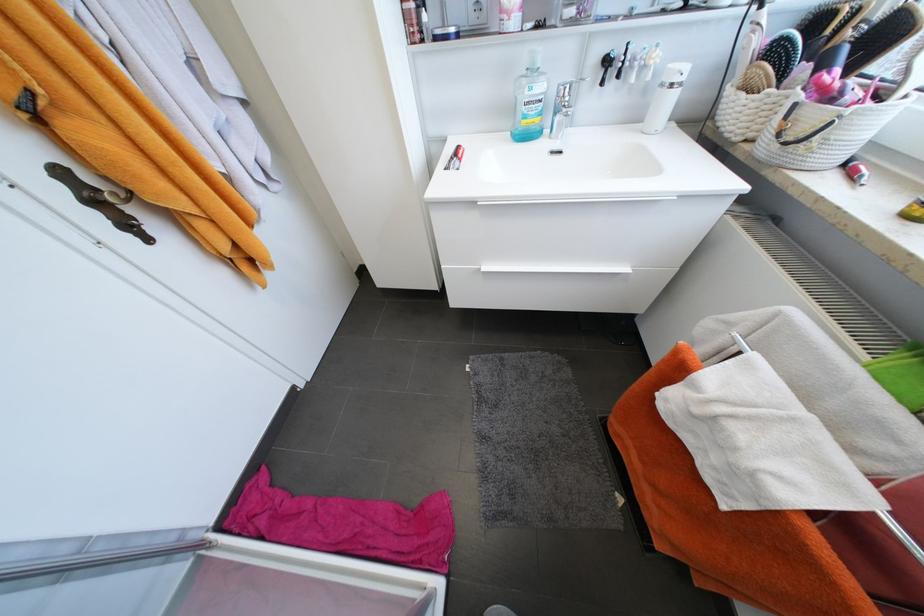
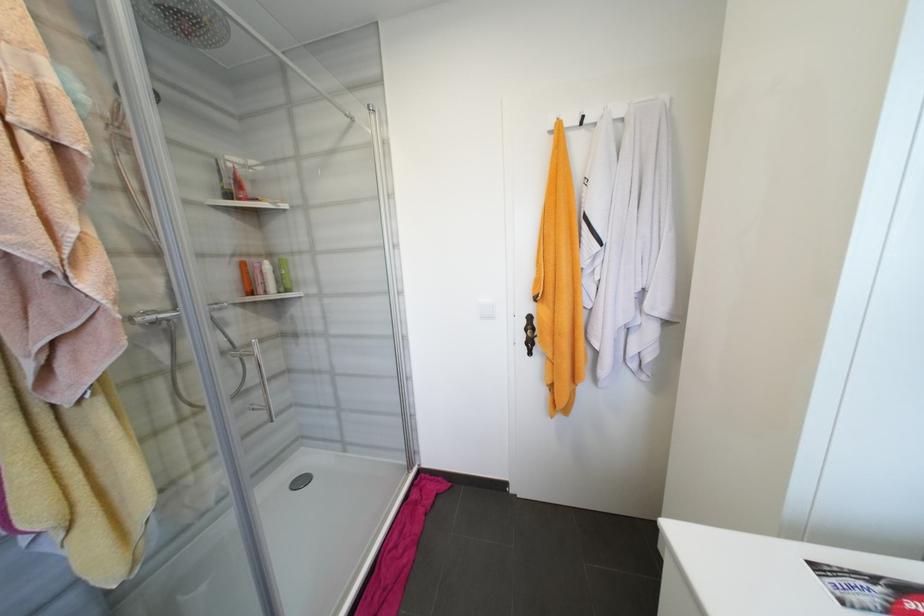
First-person continuous shooting, in which direction is the camera rotating?

The camera's rotation is toward left-down.